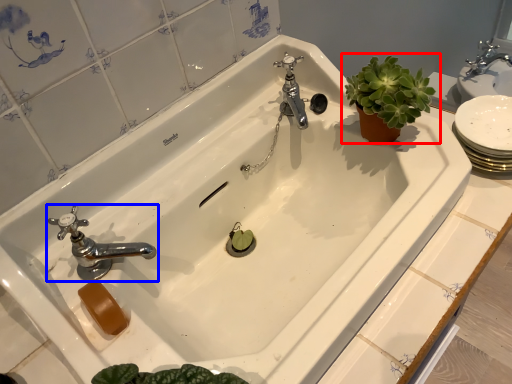
Question: Which object appears farthest to the camera in this image, houseplant (highlighted by a red box) or tap (highlighted by a blue box)?

Choices:
 (A) houseplant
 (B) tap

Answer: (A)